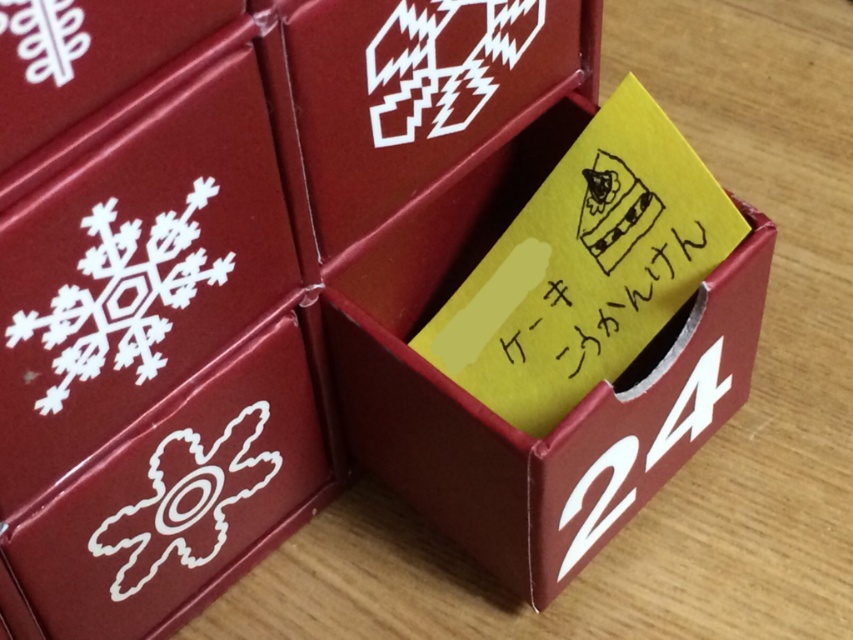
Is matte paper box at center positioned in front of matte red box at center?

No, it is not.

Is matte paper box at center to the right of matte red box at center from the viewer's perspective?

Correct, you'll find matte paper box at center to the right of matte red box at center.

Find the location of a particular element. matte paper box at center is located at coordinates (498, 417).

Can you confirm if matte red box at center is positioned to the right of yellow paper at center?

Incorrect, matte red box at center is not on the right side of yellow paper at center.

Describe the element at coordinates (421, 93) in the screenshot. I see `matte red box at center` at that location.

You are a GUI agent. You are given a task and a screenshot of the screen. Output one action in this format:
    pyautogui.click(x=<x>, y=<y>)
    Task: Click on the matte red box at center
    The height and width of the screenshot is (640, 853).
    Given the screenshot: What is the action you would take?
    pyautogui.click(x=421, y=93)

Where is `matte red box at center`? This screenshot has height=640, width=853. matte red box at center is located at coordinates (421, 93).

Does yellow paper at center have a lesser width compared to white paper snowflake at left?

In fact, yellow paper at center might be wider than white paper snowflake at left.

Is yellow paper at center smaller than white paper snowflake at left?

Incorrect, yellow paper at center is not smaller in size than white paper snowflake at left.

Between point (654, 236) and point (57, 385), which one is positioned behind?

Positioned behind is point (654, 236).

Identify the location of yellow paper at center. This screenshot has width=853, height=640. (595, 298).